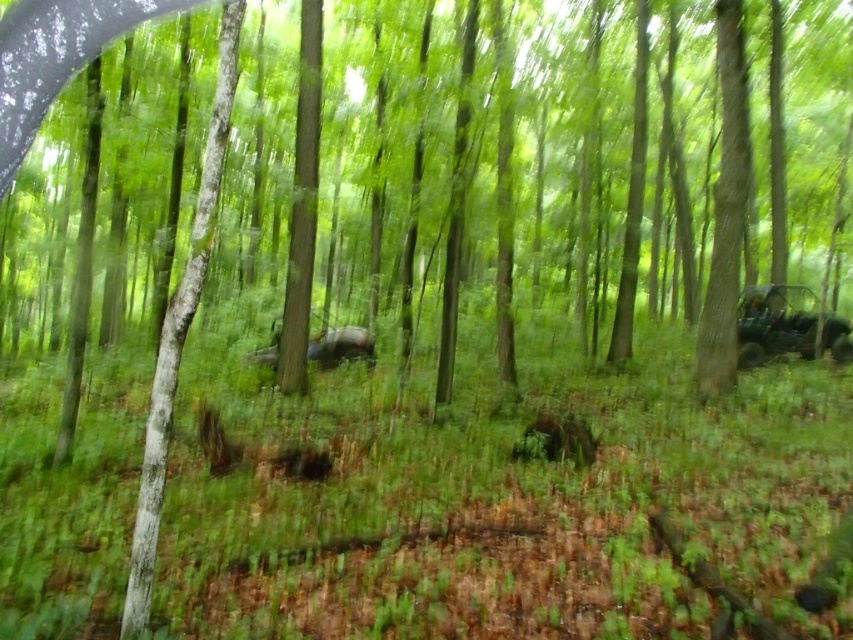
Does green matte jeep at right have a smaller size compared to green matte car at center?

Actually, green matte jeep at right might be larger than green matte car at center.

Which of these two, green matte jeep at right or green matte car at center, stands taller?

Standing taller between the two is green matte jeep at right.

Identify the location of green matte jeep at right. (775, 323).